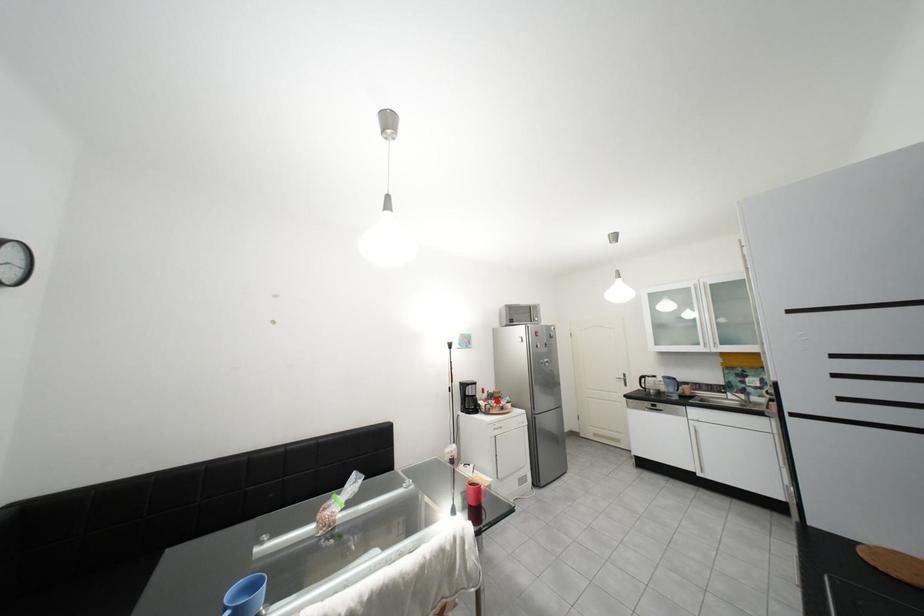
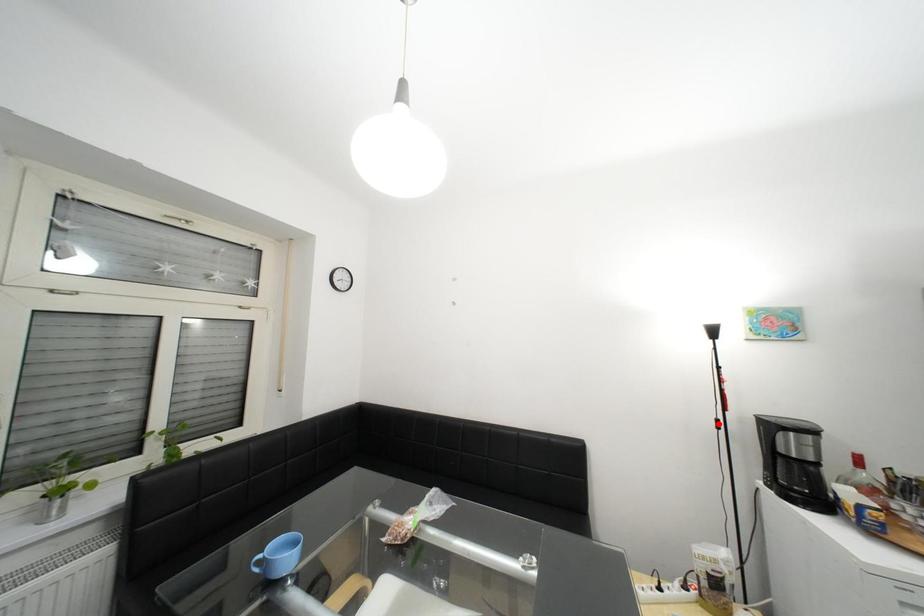
I am providing you with two images of the same scene from different viewpoints. A red point is marked on the first image and another point is marked on the second image. Are the points marked in image1 and image2 representing the same 3D position?

No